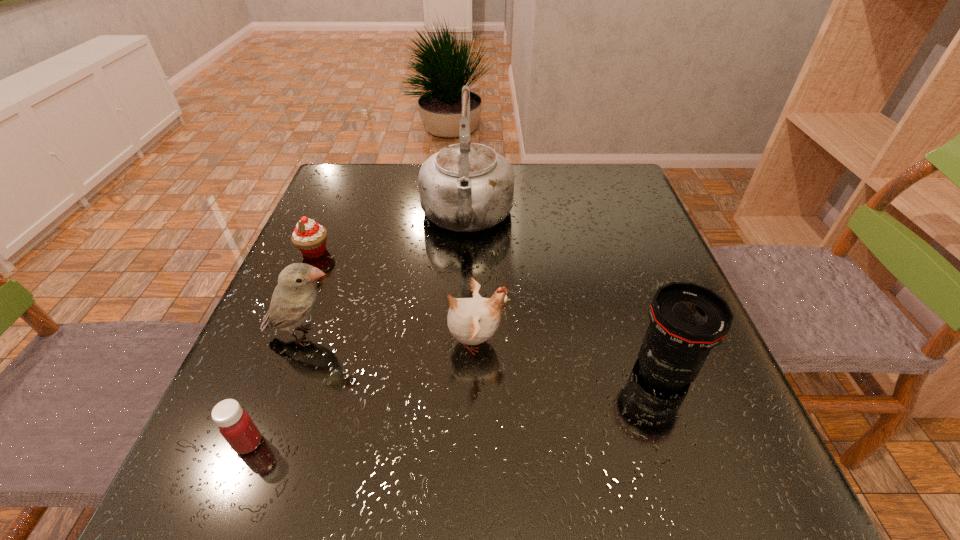
Where is `vacant space that satisfies the following two spatial constraints: 1. at the spout of the kettle; 2. at the face of the taller bird`? The height and width of the screenshot is (540, 960). vacant space that satisfies the following two spatial constraints: 1. at the spout of the kettle; 2. at the face of the taller bird is located at coordinates (463, 335).